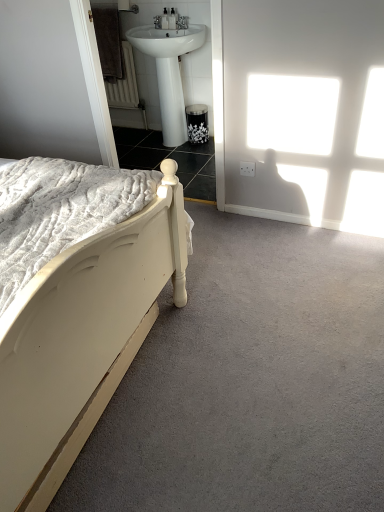
Question: Is white glossy sink at upper center taller than white painted wood bed at left?

Choices:
 (A) yes
 (B) no

Answer: (B)

Question: Is white glossy sink at upper center outside white painted wood bed at left?

Choices:
 (A) yes
 (B) no

Answer: (A)

Question: From the image's perspective, is white glossy sink at upper center on top of white painted wood bed at left?

Choices:
 (A) yes
 (B) no

Answer: (A)

Question: Can you confirm if white glossy sink at upper center is smaller than white painted wood bed at left?

Choices:
 (A) no
 (B) yes

Answer: (B)

Question: Considering the relative sizes of white glossy sink at upper center and white painted wood bed at left in the image provided, is white glossy sink at upper center thinner than white painted wood bed at left?

Choices:
 (A) yes
 (B) no

Answer: (A)

Question: From a real-world perspective, is white glossy sink at upper center above or below black metal towel bar at upper center?

Choices:
 (A) above
 (B) below

Answer: (B)

Question: Looking at their shapes, would you say white glossy sink at upper center is wider or thinner than black metal towel bar at upper center?

Choices:
 (A) thin
 (B) wide

Answer: (B)

Question: Considering their positions, is white glossy sink at upper center located in front of or behind black metal towel bar at upper center?

Choices:
 (A) front
 (B) behind

Answer: (A)

Question: From the image's perspective, is white glossy sink at upper center above or below black metal towel bar at upper center?

Choices:
 (A) above
 (B) below

Answer: (B)

Question: Is black metal towel bar at upper center spatially inside white glossy sink at upper center, or outside of it?

Choices:
 (A) outside
 (B) inside

Answer: (A)

Question: Looking at the image, does black metal towel bar at upper center seem bigger or smaller compared to white glossy sink at upper center?

Choices:
 (A) small
 (B) big

Answer: (A)

Question: From a real-world perspective, is black metal towel bar at upper center positioned above or below white glossy sink at upper center?

Choices:
 (A) below
 (B) above

Answer: (B)

Question: Based on their positions, is black metal towel bar at upper center located to the left or right of white glossy sink at upper center?

Choices:
 (A) left
 (B) right

Answer: (A)

Question: In the image, is white painted wood bed at left on the left side or the right side of black metal towel bar at upper center?

Choices:
 (A) left
 (B) right

Answer: (A)

Question: From a real-world perspective, is white painted wood bed at left above or below black metal towel bar at upper center?

Choices:
 (A) above
 (B) below

Answer: (B)